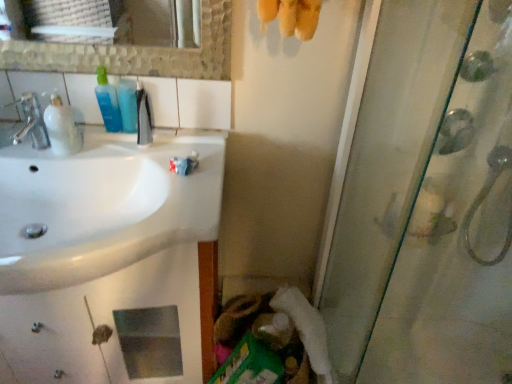
Question: From the image's perspective, does white fluffy toilet paper at lower center appear lower than translucent plastic mouthwash at left, acting as the fourth mouthwash starting from the right?

Choices:
 (A) no
 (B) yes

Answer: (B)

Question: Does white fluffy toilet paper at lower center have a greater height compared to translucent plastic mouthwash at left, which is counted as the 1th mouthwash, starting from the left?

Choices:
 (A) yes
 (B) no

Answer: (A)

Question: Does white fluffy toilet paper at lower center turn towards translucent plastic mouthwash at left, which is counted as the 1th mouthwash, starting from the left?

Choices:
 (A) no
 (B) yes

Answer: (A)

Question: From the image's perspective, is white fluffy toilet paper at lower center on top of translucent plastic mouthwash at left, which is counted as the 1th mouthwash, starting from the left?

Choices:
 (A) yes
 (B) no

Answer: (B)

Question: Can you confirm if white fluffy toilet paper at lower center is bigger than translucent plastic mouthwash at left, which is counted as the 1th mouthwash, starting from the left?

Choices:
 (A) yes
 (B) no

Answer: (A)

Question: Is translucent plastic mouthwash at left, which is counted as the 1th mouthwash, starting from the left, in front of or behind white fluffy toilet paper at lower center in the image?

Choices:
 (A) front
 (B) behind

Answer: (A)

Question: Visually, is translucent plastic mouthwash at left, which is counted as the 1th mouthwash, starting from the left, positioned to the left or to the right of white fluffy toilet paper at lower center?

Choices:
 (A) right
 (B) left

Answer: (B)

Question: From a real-world perspective, is translucent plastic mouthwash at left, which is counted as the 1th mouthwash, starting from the left, above or below white fluffy toilet paper at lower center?

Choices:
 (A) below
 (B) above

Answer: (B)

Question: Is translucent plastic mouthwash at left, which is counted as the 1th mouthwash, starting from the left, inside the boundaries of white fluffy toilet paper at lower center, or outside?

Choices:
 (A) inside
 (B) outside

Answer: (B)

Question: Considering the relative positions of matte silver faucet at left and white fluffy toilet paper at lower center in the image provided, is matte silver faucet at left to the left or to the right of white fluffy toilet paper at lower center?

Choices:
 (A) left
 (B) right

Answer: (A)

Question: Choose the correct answer: Is matte silver faucet at left inside white fluffy toilet paper at lower center or outside it?

Choices:
 (A) inside
 (B) outside

Answer: (B)

Question: Is matte silver faucet at left taller or shorter than white fluffy toilet paper at lower center?

Choices:
 (A) tall
 (B) short

Answer: (B)

Question: From a real-world perspective, relative to white fluffy toilet paper at lower center, is matte silver faucet at left vertically above or below?

Choices:
 (A) below
 (B) above

Answer: (B)

Question: Is white glossy sink at left bigger or smaller than blue translucent bottle at upper left, acting as the 2th mouthwash starting from the left?

Choices:
 (A) big
 (B) small

Answer: (A)

Question: From the image's perspective, relative to blue translucent bottle at upper left, acting as the 2th mouthwash starting from the left, is white glossy sink at left above or below?

Choices:
 (A) below
 (B) above

Answer: (A)